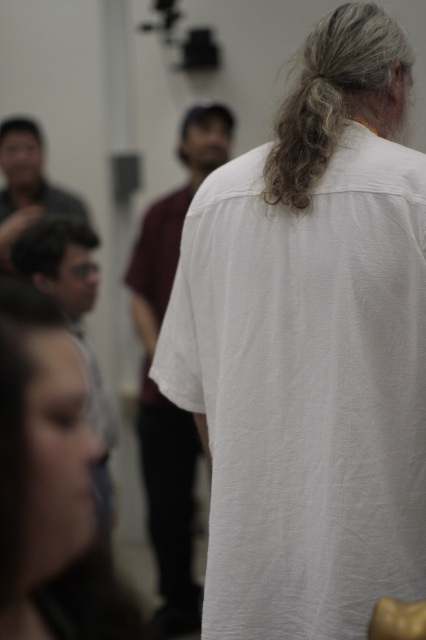
From the picture: You are a photographer trying to adjust the focus of your camera. You want to ensure that both the matte gray shirt at lower left and the brown matte hair at upper left are in focus. Given their positions, which object should you focus on first to ensure both are sharp?

The matte gray shirt at lower left is taller than brown matte hair at upper left. To ensure both are in focus, you should focus on the matte gray shirt at lower left first, as it is closer to the camera and adjusting focus there will help capture both objects within the depth of field.

You are a photographer trying to capture a clear shot of the two people with dark brown hair at lower left and brown matte hair at upper left. Which one should you focus on to ensure the subject is sharp and in focus?

You should focus on the dark brown hair at lower left because it is closer to the viewer than the brown matte hair at upper left, so focusing on it will keep it sharp while the other may be slightly blurred.

You are a photographer trying to capture a clear shot of the matte gray shirt at lower left and the brown matte hair at upper left. Since you can only focus on one subject at a time, which one should you choose to ensure the other remains in the background blur?

The matte gray shirt at lower left is closer to you than the brown matte hair at upper left. If you focus on the matte gray shirt at lower left, the brown matte hair at upper left will be in the background blur.